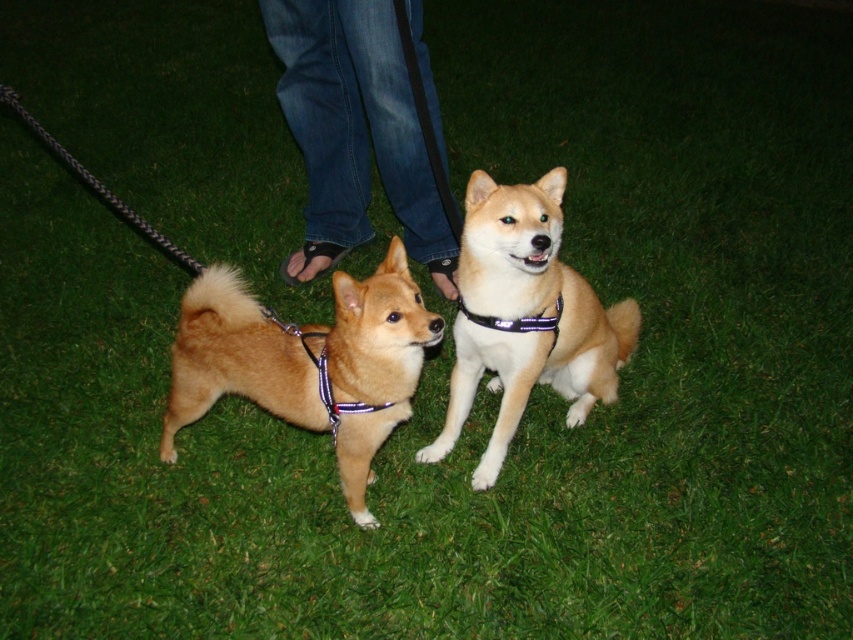
You are a photographer trying to capture both the shiny brown dog at center and the light brown fur at center in a single frame. Based on their positions, which dog should you focus on first to ensure both are in the shot?

The shiny brown dog at center is to the left of light brown fur at center, so you should focus on the shiny brown dog at center first to ensure both are in the shot.

Consider the image. You are a photographer trying to capture the shiny brown dog at center and the light brown fur at center in a single shot. Which one should you focus on first to ensure both are in focus?

You should focus on the shiny brown dog at center first because it is closer to the viewer than the light brown fur at center, so adjusting focus from near to far will help both be in focus.